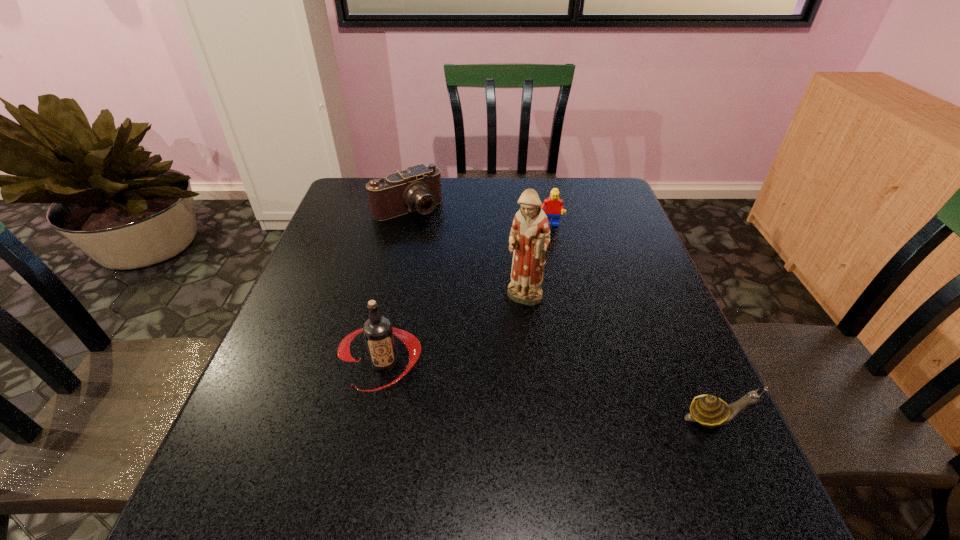
The image size is (960, 540). What are the coordinates of `object at the left edge` in the screenshot? It's located at (418, 188).

Where is `object that is at the right edge`? object that is at the right edge is located at coordinates (710, 411).

Where is `object that is at the far left corner`? object that is at the far left corner is located at coordinates (418, 188).

This screenshot has width=960, height=540. In order to click on object located in the near right corner section of the desktop in this screenshot , I will do `click(710, 411)`.

The image size is (960, 540). What are the coordinates of `vacant space at the far edge of the desktop` in the screenshot? It's located at (444, 190).

The image size is (960, 540). Find the location of `free region at the near edge`. free region at the near edge is located at coordinates (640, 446).

The image size is (960, 540). What are the coordinates of `vacant space at the left edge` in the screenshot? It's located at 285,356.

In order to click on vacant region at the right edge of the desktop in this screenshot , I will do `click(648, 302)`.

This screenshot has height=540, width=960. In order to click on blank space at the far right corner in this screenshot , I will do `click(605, 212)`.

The image size is (960, 540). I want to click on blank region between the camera and the second nearest object, so click(x=396, y=286).